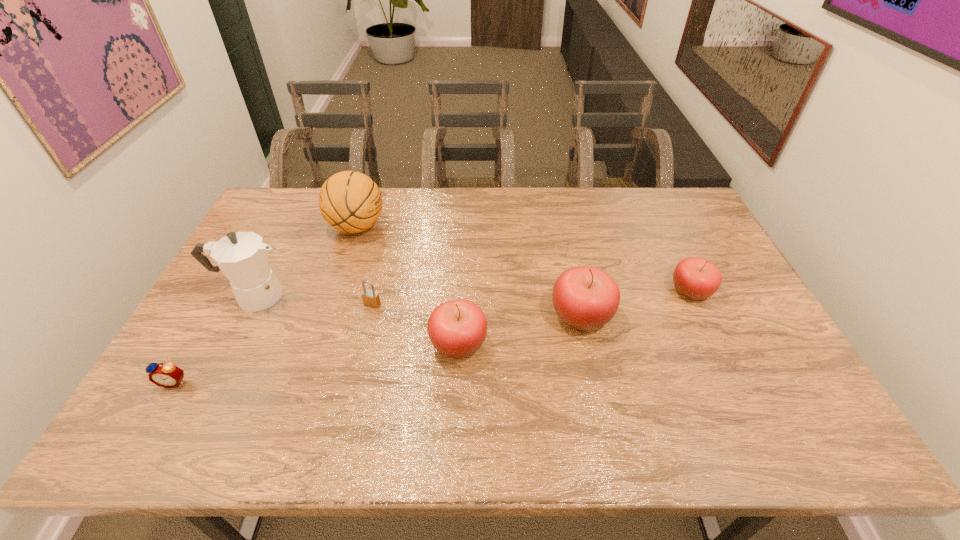
I want to click on vacant region located on the left of the second object from right to left, so click(x=420, y=316).

Find the location of a particular element. free space located on the left of the rightmost apple is located at coordinates (614, 291).

Identify the location of vacant space located on the surface of the basketball near the brand logo. (459, 227).

This screenshot has width=960, height=540. What are the coordinates of `vacant space located 0.390m at the spout of the coffeepot` in the screenshot? It's located at (425, 296).

You are a GUI agent. You are given a task and a screenshot of the screen. Output one action in this format:
    pyautogui.click(x=<x>, y=<y>)
    Task: Click on the free point located 0.100m on the left of the padlock
    
    Given the screenshot: What is the action you would take?
    pyautogui.click(x=329, y=304)

Where is `object that is at the far edge`? This screenshot has width=960, height=540. object that is at the far edge is located at coordinates (349, 201).

Where is `object at the near edge`? This screenshot has height=540, width=960. object at the near edge is located at coordinates (168, 375).

Locate an element on the screen. The width and height of the screenshot is (960, 540). coffeepot present at the left edge is located at coordinates (242, 256).

In order to click on alarm clock located in the left edge section of the desktop in this screenshot , I will do `click(168, 375)`.

What are the coordinates of `object that is at the right edge` in the screenshot? It's located at (695, 278).